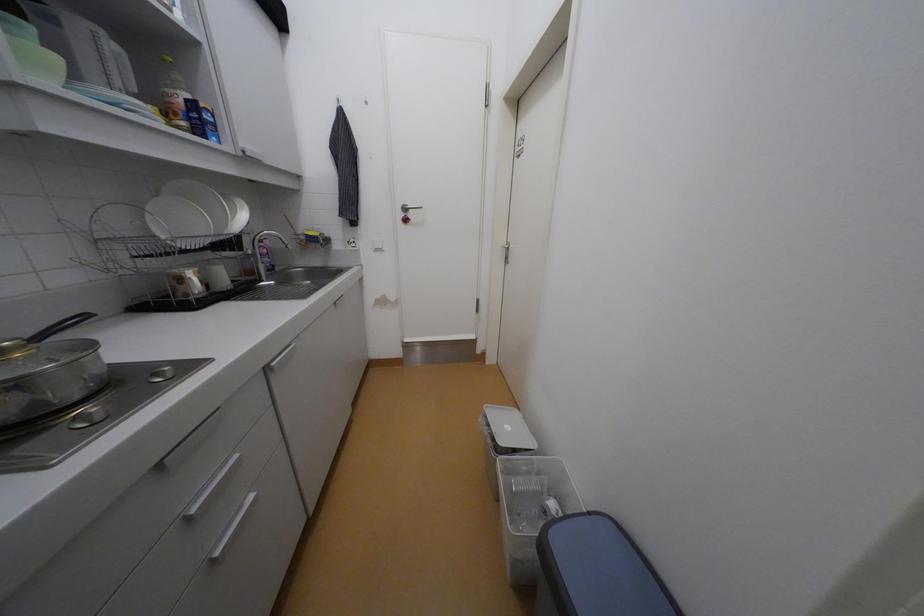
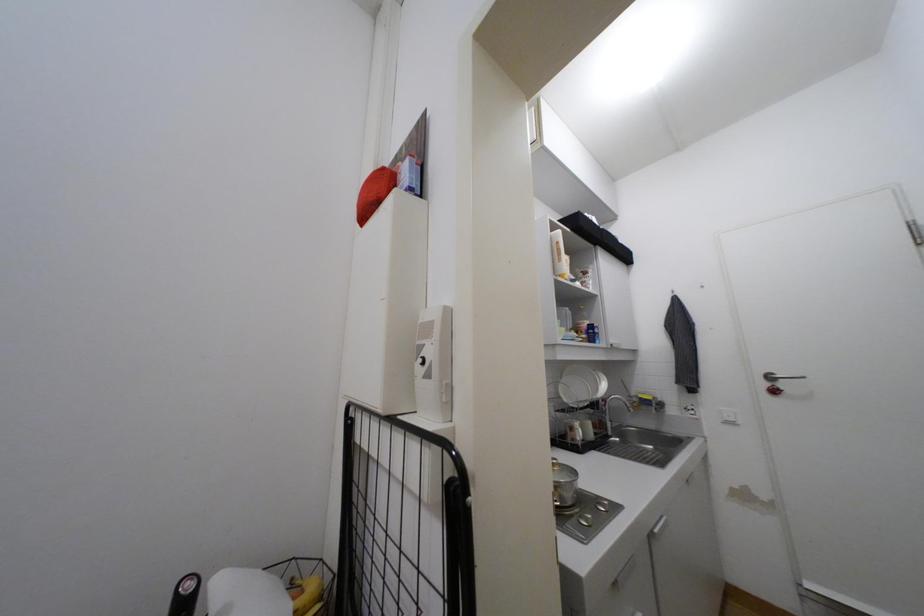
First-person continuous shooting, in which direction is the camera rotating?

The rotation direction of the camera is left-up.